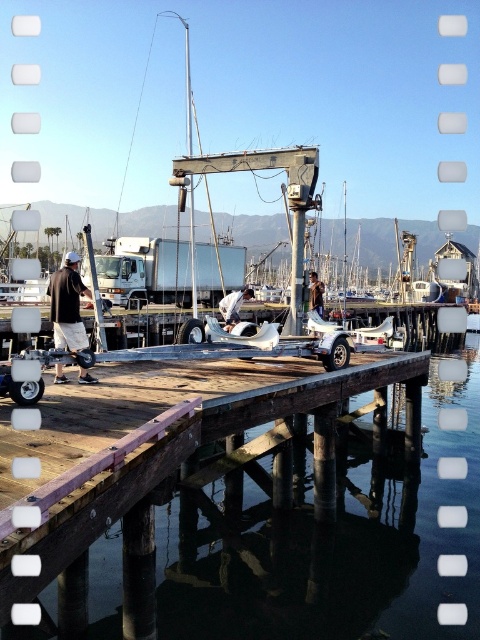
Question: Which of the following is the farthest from the observer?

Choices:
 (A) white fabric sailboat at center
 (B) dark gray shorts at center
 (C) brown leather jacket at center

Answer: (C)

Question: Can you confirm if transparent water at center is positioned to the right of dark gray shorts at center?

Choices:
 (A) no
 (B) yes

Answer: (B)

Question: Can you confirm if white fabric sailboat at center is smaller than brown leather jacket at center?

Choices:
 (A) no
 (B) yes

Answer: (A)

Question: Can you confirm if transparent water at center is bigger than white fabric sailboat at center?

Choices:
 (A) yes
 (B) no

Answer: (A)

Question: Which of the following is the closest to the observer?

Choices:
 (A) (247, 534)
 (B) (232, 317)

Answer: (A)

Question: Among these points, which one is nearest to the camera?

Choices:
 (A) (232, 323)
 (B) (313, 294)

Answer: (A)